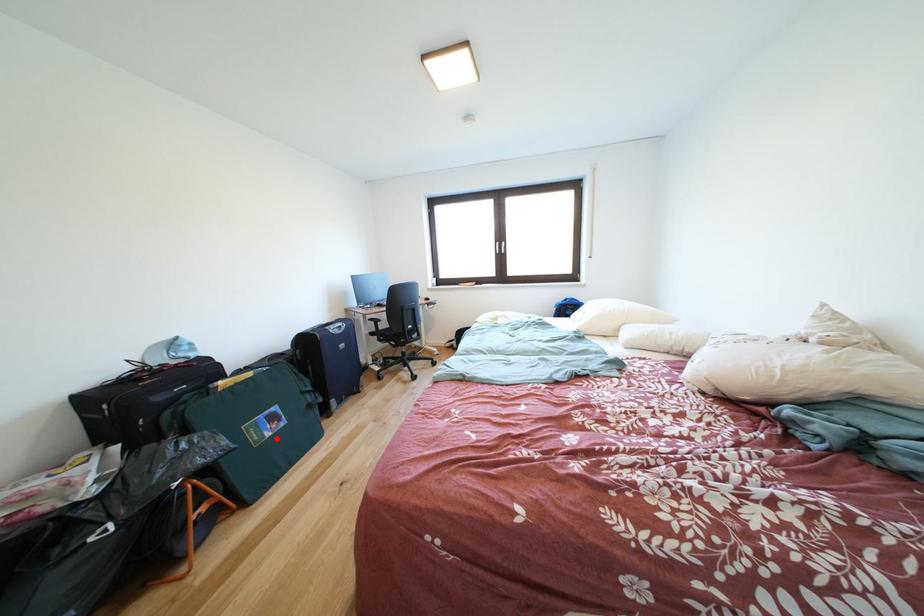
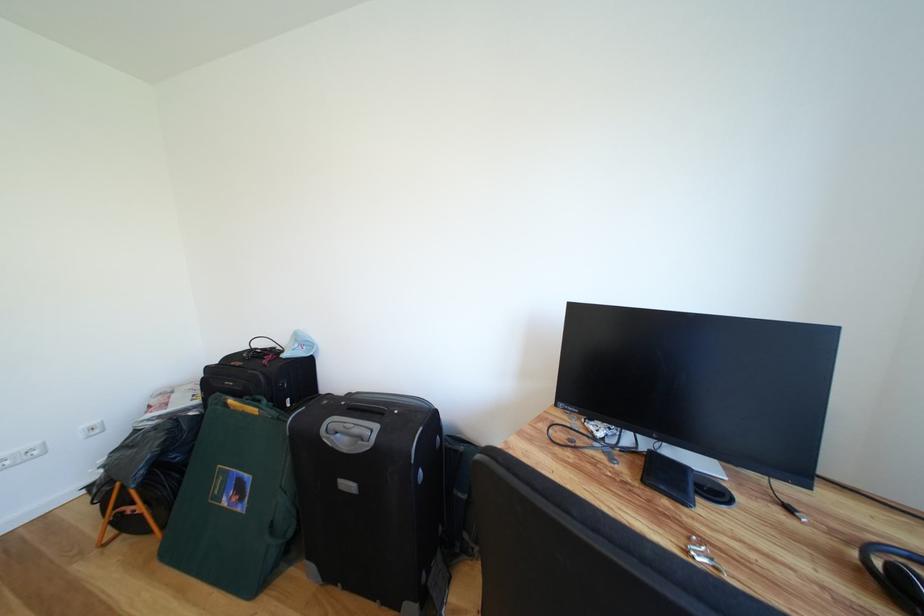
Find the pixel in the second image that matches the highlighted location in the first image.

(234, 506)